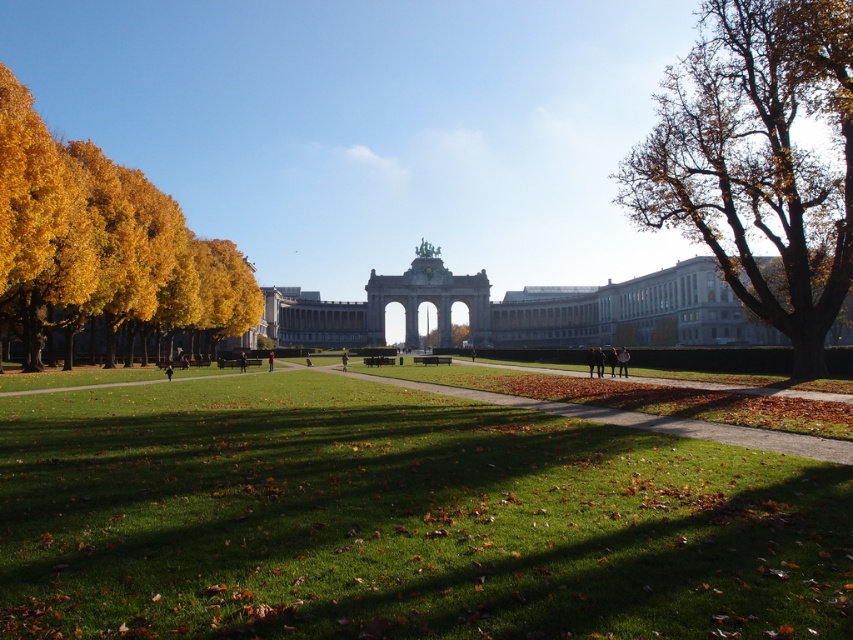
You are planning to set up a picnic blanket in the green grassy field at center. However, you want to ensure there is enough space between the picnic area and the brown leafy tree at right to avoid any falling branches. If the picnic blanket is 2 meters in diameter, what is the minimum safe distance you should maintain between the edge of the blanket and the tree to ensure safety?

The green grassy field at center and brown leafy tree at right are 66.65 meters apart. Since the picnic blanket is 2 meters in diameter, the minimum safe distance between the edge of the blanket and the tree should be at least 2 meters to ensure safety.